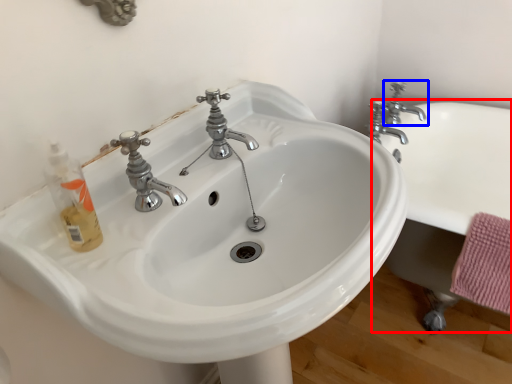
Question: Which object appears closest to the camera in this image, bath (highlighted by a red box) or tap (highlighted by a blue box)?

Choices:
 (A) bath
 (B) tap

Answer: (A)